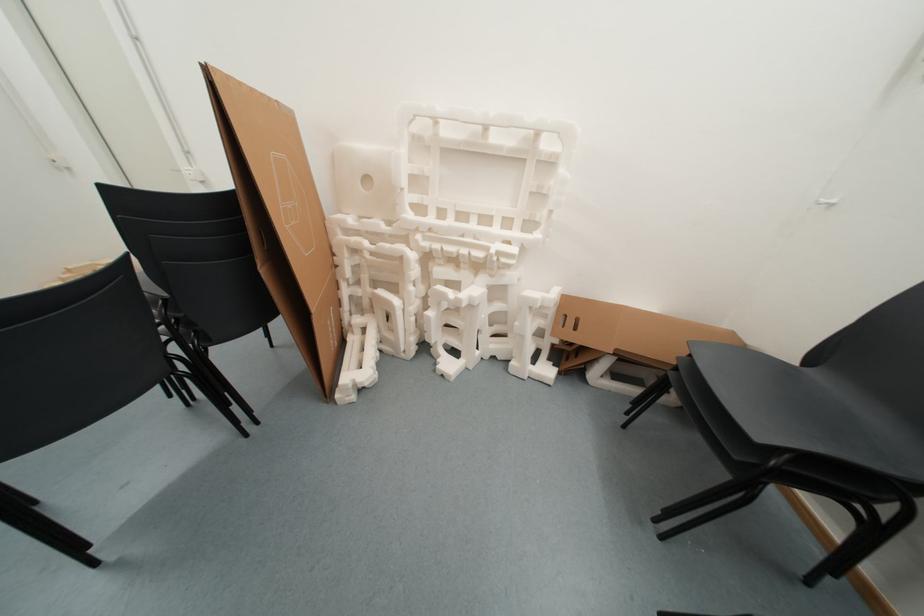
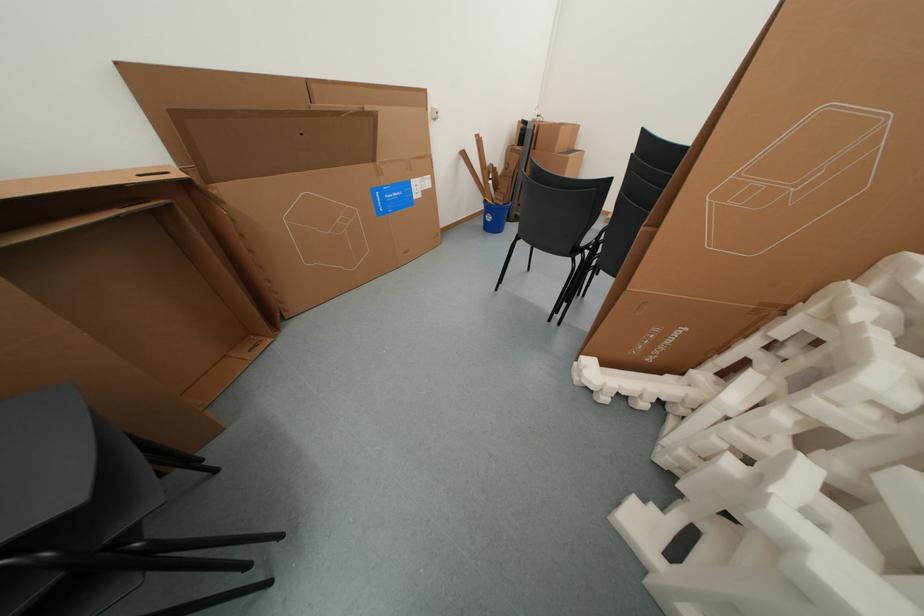
Based on the continuous images, in which direction is the camera rotating?

The rotation direction of the camera is left-down.